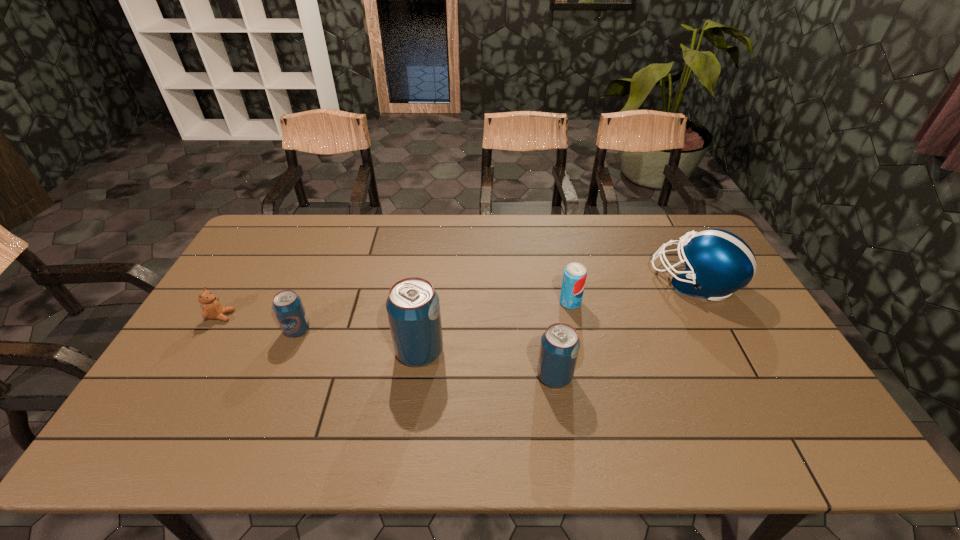
Where is `vacant area situated 0.330m on the back of the leftmost soda can`? The image size is (960, 540). vacant area situated 0.330m on the back of the leftmost soda can is located at coordinates (329, 250).

Locate an element on the screen. The height and width of the screenshot is (540, 960). vacant area situated 0.270m on the right of the third object from left to right is located at coordinates (542, 352).

Locate an element on the screen. vacant region located on the right of the third shortest soda can is located at coordinates (657, 376).

This screenshot has width=960, height=540. In order to click on blank space located on the face of the teddy bear in this screenshot , I will do `click(338, 316)`.

Find the location of a particular element. vacant space located at the front of the rightmost object with the faceguard is located at coordinates pyautogui.click(x=536, y=282).

What are the coordinates of `free spot located at the front of the rightmost object with the faceguard` in the screenshot? It's located at (561, 282).

This screenshot has width=960, height=540. I want to click on blank space located 0.250m at the front of the rightmost object with the faceguard, so click(x=576, y=282).

This screenshot has width=960, height=540. Identify the location of blank space located 0.370m on the back of the fifth object from left to right. (554, 226).

Where is `object present at the near edge`? object present at the near edge is located at coordinates (560, 344).

Find the location of `object that is at the left edge`. object that is at the left edge is located at coordinates (212, 309).